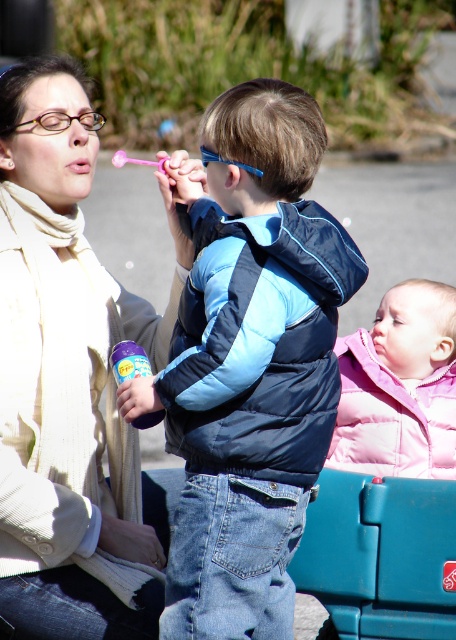
You are a photographer trying to capture a shot of the matte beige scarf at upper left and the blue synthetic puffer jacket at center. Based on their positions, which object should you focus on first if you want to frame them from left to right?

The matte beige scarf at upper left should be focused on first since it is positioned on the left side of the blue synthetic puffer jacket at center, making it the leftmost object in the frame.

You are a photographer trying to capture a group photo of the blue down jacket at center and the pink puffy jacket at lower right. What is the minimum distance you need to maintain between them to ensure both are in frame?

The minimum distance you need to maintain between the blue down jacket at center and the pink puffy jacket at lower right is 3.70 feet to ensure both are in frame.